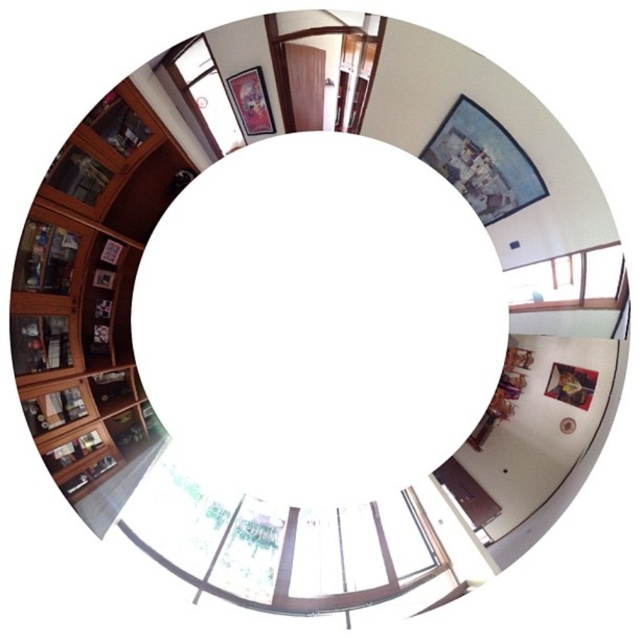
Who is positioned more to the right, wooden picture frame at lower right or matte black circle at lower right?

Positioned to the right is wooden picture frame at lower right.

Is wooden picture frame at lower right taller than matte black circle at lower right?

Yes, wooden picture frame at lower right is taller than matte black circle at lower right.

Locate an element on the screen. The height and width of the screenshot is (640, 640). wooden picture frame at lower right is located at coordinates (570, 385).

I want to click on wooden picture frame at lower right, so pyautogui.click(x=570, y=385).

Between wooden bookshelf at left and wooden picture frame at lower right, which one is positioned higher?

wooden bookshelf at left

Can you confirm if wooden bookshelf at left is wider than wooden picture frame at lower right?

Yes, wooden bookshelf at left is wider than wooden picture frame at lower right.

This screenshot has width=640, height=640. Find the location of `wooden bookshelf at left`. wooden bookshelf at left is located at coordinates (90, 298).

Is white matte circle at center smaller than wooden picture frame at lower right?

No.

Is white matte circle at center shorter than wooden picture frame at lower right?

In fact, white matte circle at center may be taller than wooden picture frame at lower right.

Between point (205, 376) and point (586, 378), which one is positioned in front?

Point (586, 378) is in front.

At what (x,y) coordinates should I click in order to perform the action: click on white matte circle at center. Please return your answer as a coordinate pair (x, y). The image size is (640, 640). Looking at the image, I should click on (320, 317).